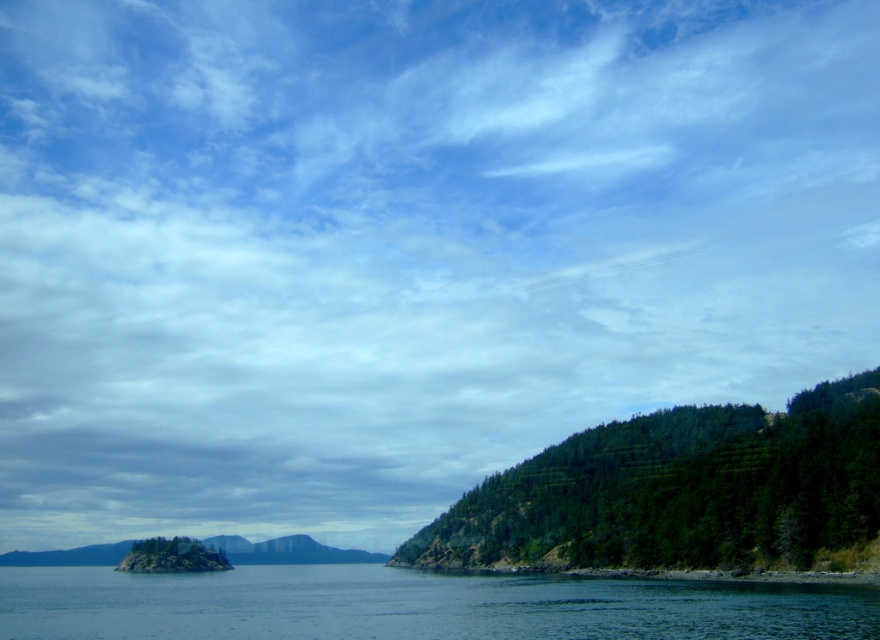
Can you confirm if clear blue water at lower center is taller than green forested mountain at lower left?

Yes, clear blue water at lower center is taller than green forested mountain at lower left.

What are the coordinates of `clear blue water at lower center` in the screenshot? It's located at (416, 605).

Who is more distant from viewer, (375, 566) or (82, 554)?

Positioned behind is point (82, 554).

This screenshot has width=880, height=640. I want to click on clear blue water at lower center, so click(x=416, y=605).

Which is behind, point (620, 516) or point (290, 561)?

Point (290, 561)

Is green textured hillside at right positioned in front of green forested mountain at lower left?

Yes, green textured hillside at right is in front of green forested mountain at lower left.

Is point (560, 547) less distant than point (4, 563)?

Yes, point (560, 547) is in front of point (4, 563).

The width and height of the screenshot is (880, 640). In order to click on green textured hillside at right in this screenshot , I will do `click(682, 492)`.

Image resolution: width=880 pixels, height=640 pixels. What do you see at coordinates (682, 492) in the screenshot? I see `green textured hillside at right` at bounding box center [682, 492].

Measure the distance between green textured hillside at right and camera.

They are 133.90 meters apart.

Identify the location of green textured hillside at right. The height and width of the screenshot is (640, 880). (682, 492).

Locate an element on the screen. green textured hillside at right is located at coordinates (682, 492).